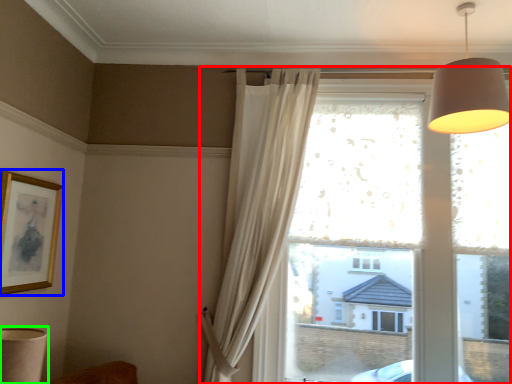
Question: Based on their relative distances, which object is farther from window (highlighted by a red box)? Choose from picture frame (highlighted by a blue box) and table lamp (highlighted by a green box).

Choices:
 (A) picture frame
 (B) table lamp

Answer: (B)